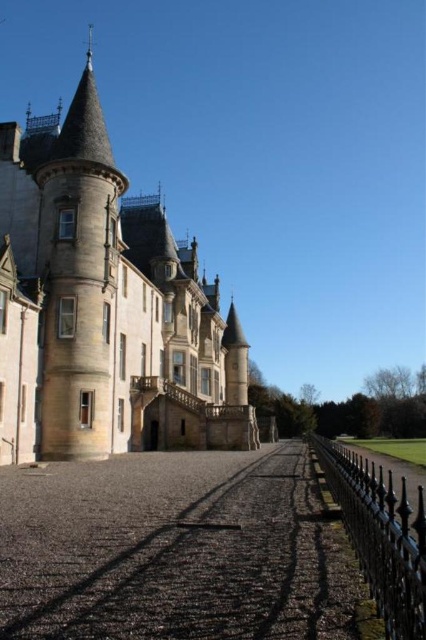
Question: Which point appears closest to the camera in this image?

Choices:
 (A) pyautogui.click(x=146, y=620)
 (B) pyautogui.click(x=74, y=324)
 (C) pyautogui.click(x=399, y=547)

Answer: (C)

Question: Observing the image, what is the correct spatial positioning of brown stone castle at center in reference to black wrought iron fence at lower right?

Choices:
 (A) right
 (B) left

Answer: (B)

Question: In this image, where is brown stone castle at center located relative to black wrought iron fence at lower right?

Choices:
 (A) above
 (B) below

Answer: (A)

Question: Which of these objects is positioned farthest from the dark asphalt driveway at center?

Choices:
 (A) brown stone castle at center
 (B) black wrought iron fence at lower right

Answer: (A)

Question: Does dark asphalt driveway at center have a greater width compared to black wrought iron fence at lower right?

Choices:
 (A) yes
 (B) no

Answer: (A)

Question: Based on their relative distances, which object is farther from the black wrought iron fence at lower right?

Choices:
 (A) brown stone castle at center
 (B) dark asphalt driveway at center

Answer: (A)